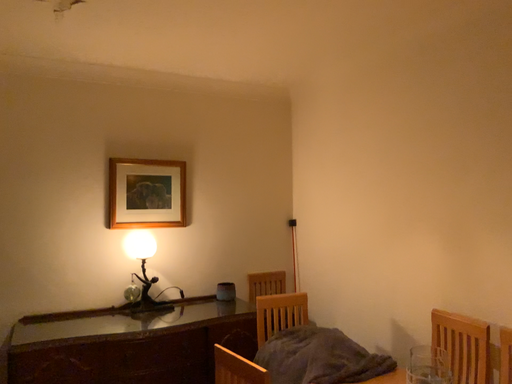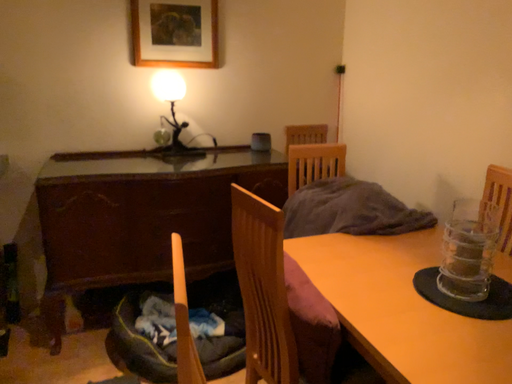
Question: How did the camera likely rotate when shooting the video?

Choices:
 (A) rotated right
 (B) rotated left

Answer: (B)